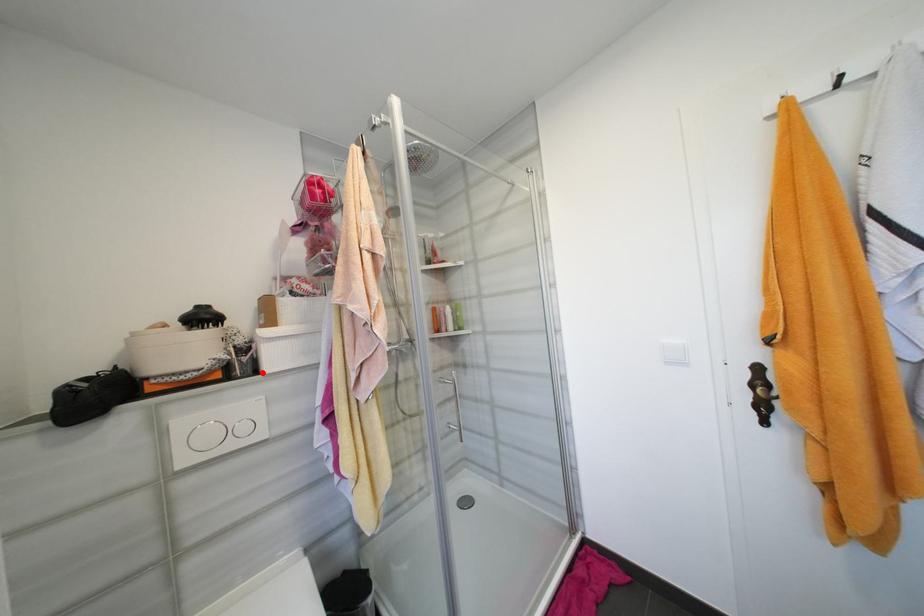
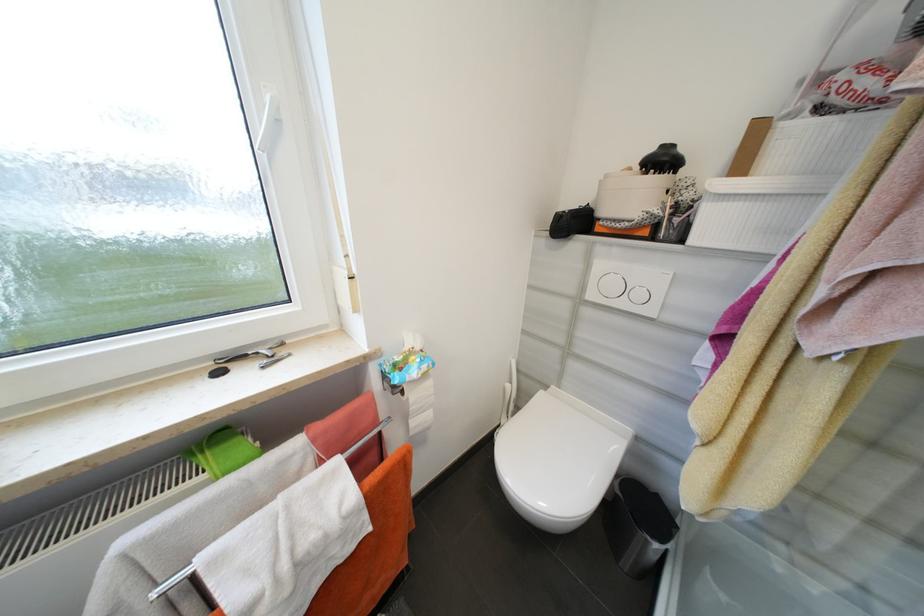
In the second image, find the point that corresponds to the highlighted location in the first image.

(687, 241)